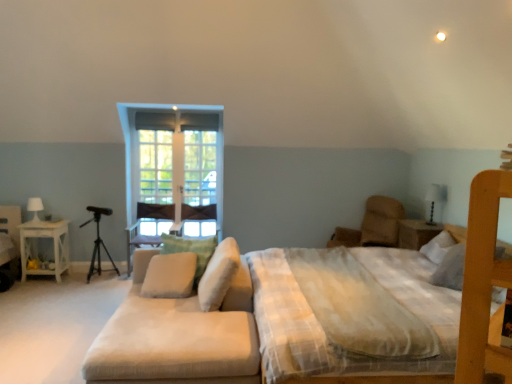
Describe the element at coordinates (98, 241) in the screenshot. I see `black matte tripod at left` at that location.

The image size is (512, 384). Describe the element at coordinates (322, 328) in the screenshot. I see `white soft mattress at center` at that location.

This screenshot has width=512, height=384. I want to click on white soft pillow at center, acting as the third pillow starting from the left, so click(218, 275).

From the picture: What is the approximate height of beige fabric pillow at center, which is the 2th pillow in left-to-right order?

beige fabric pillow at center, which is the 2th pillow in left-to-right order, is 22.46 inches in height.

Find the location of a particular element. clear glass screen door at center is located at coordinates (200, 168).

Is white wood nightstand at left, which is counted as the 2th nightstand, starting from the right, in front of or behind white glossy table lamp at left, the second table lamp when ordered from right to left, in the image?

Visually, white wood nightstand at left, which is counted as the 2th nightstand, starting from the right, is located in front of white glossy table lamp at left, the second table lamp when ordered from right to left.

Can you confirm if white wood nightstand at left, which is counted as the 2th nightstand, starting from the right, is bigger than white glossy table lamp at left, positioned as the 1th table lamp in back-to-front order?

Indeed, white wood nightstand at left, which is counted as the 2th nightstand, starting from the right, has a larger size compared to white glossy table lamp at left, positioned as the 1th table lamp in back-to-front order.

Is point (368, 240) positioned behind point (212, 240)?

That is True.

Could you measure the distance between brown fabric swivel chair at center-right and beige fabric pillow at center, which is the 2th pillow in right-to-left order?

brown fabric swivel chair at center-right is 2.54 meters from beige fabric pillow at center, which is the 2th pillow in right-to-left order.

Is brown fabric swivel chair at center-right far away from beige fabric pillow at center, which is the 2th pillow in right-to-left order?

Absolutely, brown fabric swivel chair at center-right is distant from beige fabric pillow at center, which is the 2th pillow in right-to-left order.

Between brown fabric swivel chair at center-right and beige fabric pillow at center, which is the 2th pillow in left-to-right order, which one has less height?

Standing shorter between the two is beige fabric pillow at center, which is the 2th pillow in left-to-right order.

From the image's perspective, which is below, black matte tripod at left or white glossy table lamp at upper right, which appears as the 2th table lamp when viewed from the back?

black matte tripod at left is shown below in the image.

Would you say black matte tripod at left is outside white glossy table lamp at upper right, which appears as the first table lamp when viewed from the right?

Absolutely, black matte tripod at left is external to white glossy table lamp at upper right, which appears as the first table lamp when viewed from the right.

From a real-world perspective, is black matte tripod at left over white glossy table lamp at upper right, which appears as the first table lamp when viewed from the right?

No, from a real-world perspective, black matte tripod at left is not over white glossy table lamp at upper right, which appears as the first table lamp when viewed from the right

Relative to white glossy table lamp at upper right, which appears as the second table lamp when viewed from the left, is black matte tripod at left in front or behind?

black matte tripod at left is positioned farther from the viewer than white glossy table lamp at upper right, which appears as the second table lamp when viewed from the left.

Is black matte tripod at left far away from clear glass window at center?

Absolutely, black matte tripod at left is distant from clear glass window at center.

Considering the relative sizes of black matte tripod at left and clear glass window at center in the image provided, is black matte tripod at left smaller than clear glass window at center?

No.

In terms of width, does black matte tripod at left look wider or thinner when compared to clear glass window at center?

In the image, black matte tripod at left appears to be wider than clear glass window at center.

Is black matte tripod at left facing towards clear glass window at center?

No, black matte tripod at left does not turn towards clear glass window at center.

Can we say white glossy table lamp at upper right, which appears as the 2th table lamp when viewed from the back, lies outside clear glass window at center?

Yes, white glossy table lamp at upper right, which appears as the 2th table lamp when viewed from the back, is located beyond the bounds of clear glass window at center.

In the image, is white glossy table lamp at upper right, which appears as the first table lamp when viewed from the front, on the left side or the right side of clear glass window at center?

Based on their positions, white glossy table lamp at upper right, which appears as the first table lamp when viewed from the front, is located to the right of clear glass window at center.

Which of these two, white glossy table lamp at upper right, which appears as the second table lamp when viewed from the left, or clear glass window at center, is thinner?

Thinner between the two is clear glass window at center.

From the picture: Is white glossy table lamp at upper right, which appears as the 2th table lamp when viewed from the back, facing away from clear glass window at center?

No, white glossy table lamp at upper right, which appears as the 2th table lamp when viewed from the back,'s orientation is not away from clear glass window at center.

Can you confirm if brown fabric swivel chair at center-right is smaller than clear glass screen door at center?

Incorrect, brown fabric swivel chair at center-right is not smaller in size than clear glass screen door at center.

From the image's perspective, is brown fabric swivel chair at center-right above clear glass screen door at center?

Incorrect, from the image's perspective, brown fabric swivel chair at center-right is lower than clear glass screen door at center.

Can you confirm if brown fabric swivel chair at center-right is taller than clear glass screen door at center?

No, brown fabric swivel chair at center-right is not taller than clear glass screen door at center.

How distant is brown fabric swivel chair at center-right from clear glass screen door at center?

brown fabric swivel chair at center-right and clear glass screen door at center are 2.19 meters apart.

From the image's perspective, which is above, beige fabric armchair at center or brown fabric swivel chair at center-right?

brown fabric swivel chair at center-right appears higher in the image.

In terms of size, does beige fabric armchair at center appear bigger or smaller than brown fabric swivel chair at center-right?

Clearly, beige fabric armchair at center is smaller in size than brown fabric swivel chair at center-right.

Considering the relative positions of beige fabric armchair at center and brown fabric swivel chair at center-right in the image provided, is beige fabric armchair at center to the right of brown fabric swivel chair at center-right from the viewer's perspective?

No.

Is beige fabric armchair at center aimed at brown fabric swivel chair at center-right?

No, beige fabric armchair at center does not turn towards brown fabric swivel chair at center-right.

Find the location of a particular element. The height and width of the screenshot is (384, 512). table lamp behind the white wood nightstand at left, which is counted as the 2th nightstand, starting from the right is located at coordinates (35, 207).

Identify the location of swivel chair positioned vertically above the beige fabric pillow at center, which is the 2th pillow in right-to-left order (from a real-world perspective). The height and width of the screenshot is (384, 512). (373, 225).

Estimate the real-world distances between objects in this image. Which object is closer to beige fabric couch at lower left, white glossy table lamp at left, positioned as the 2th table lamp in front-to-back order, or white soft mattress at center?

white soft mattress at center is positioned closer to the anchor beige fabric couch at lower left.

In the scene shown: When comparing their distances from clear glass screen door at center, does white soft pillow at center, which appears as the 1th pillow when viewed from the right, or clear glass window at center seem further?

white soft pillow at center, which appears as the 1th pillow when viewed from the right, is further to clear glass screen door at center.

Based on their spatial positions, is beige fabric couch at lower left or black matte tripod at left closer to white soft pillow at center, which appears as the 1th pillow when viewed from the right?

The object closer to white soft pillow at center, which appears as the 1th pillow when viewed from the right, is beige fabric couch at lower left.

Estimate the real-world distances between objects in this image. Which object is further from beige fabric couch at lower left, black matte tripod at left or white glossy table lamp at upper right, which appears as the first table lamp when viewed from the front?

The object further to beige fabric couch at lower left is white glossy table lamp at upper right, which appears as the first table lamp when viewed from the front.

When comparing their distances from brown fabric swivel chair at center-right, does white soft pillow at center, acting as the third pillow starting from the left, or black matte tripod at left seem further?

black matte tripod at left is further to brown fabric swivel chair at center-right.

Based on their spatial positions, is brown fabric swivel chair at center-right or beige fabric pillow at center, the first pillow viewed from the left, closer to beige fabric pillow at center, which is the 2th pillow in left-to-right order?

beige fabric pillow at center, the first pillow viewed from the left, lies closer to beige fabric pillow at center, which is the 2th pillow in left-to-right order, than the other object.

Based on their spatial positions, is clear glass window at center or beige fabric armchair at center further from white glossy table lamp at left, which is the 1th table lamp in left-to-right order?

Based on the image, clear glass window at center appears to be further to white glossy table lamp at left, which is the 1th table lamp in left-to-right order.

Which object lies further to the anchor point white soft pillow at center, acting as the third pillow starting from the left, beige fabric pillow at center, which is counted as the 3th pillow, starting from the right, or clear glass window at center?

Among the two, clear glass window at center is located further to white soft pillow at center, acting as the third pillow starting from the left.

This screenshot has width=512, height=384. What are the coordinates of `studio couch between white wood nightstand at left, marked as the 1th nightstand in a left-to-right arrangement, and white wood nightstand at right, which is the first nightstand in right-to-left order` in the screenshot? It's located at (180, 324).

This screenshot has width=512, height=384. What are the coordinates of `screen door between clear glass window at center and beige fabric armchair at center vertically` in the screenshot? It's located at (200, 168).

Where is `tripod positioned between white soft pillow at center, which appears as the 1th pillow when viewed from the right, and clear glass screen door at center from near to far`? The height and width of the screenshot is (384, 512). tripod positioned between white soft pillow at center, which appears as the 1th pillow when viewed from the right, and clear glass screen door at center from near to far is located at coordinates (98, 241).

Locate an element on the screen. This screenshot has width=512, height=384. tripod between white soft mattress at center and clear glass window at center from front to back is located at coordinates (98, 241).